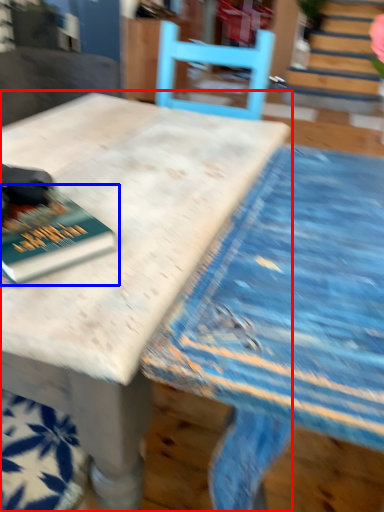
Question: Which object is further to the camera taking this photo, table (highlighted by a red box) or book (highlighted by a blue box)?

Choices:
 (A) table
 (B) book

Answer: (B)